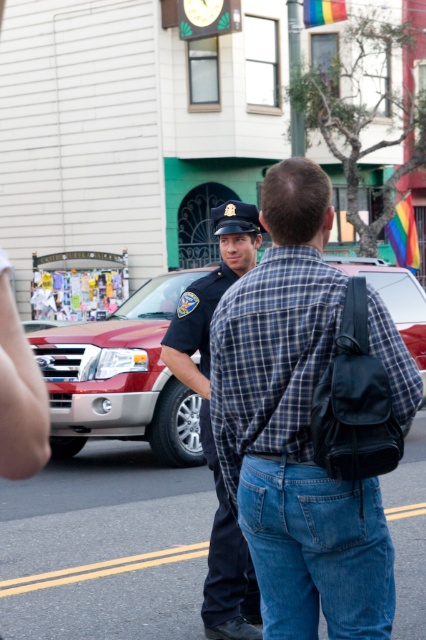
Does blue plaid shirt at center appear over dark blue uniform at center?

Indeed, blue plaid shirt at center is positioned over dark blue uniform at center.

Which of these two, blue plaid shirt at center or dark blue uniform at center, stands shorter?

blue plaid shirt at center is shorter.

Measure the distance between point [229,404] and camera.

10.60 feet

Find the location of `blue plaid shirt at center`. blue plaid shirt at center is located at coordinates (294, 428).

Who is more distant from viewer, (313,164) or (57,408)?

Positioned behind is point (57,408).

Which is below, blue plaid shirt at center or metallic red suv at center-left?

Positioned lower is metallic red suv at center-left.

The image size is (426, 640). In order to click on blue plaid shirt at center in this screenshot , I will do `click(294, 428)`.

Can you confirm if metallic red suv at center-left is taller than dark blue uniform at center?

No.

Is point (94, 372) farther from viewer compared to point (222, 280)?

Yes.

Is point (195, 440) farther from viewer compared to point (224, 636)?

Yes, it is.

The width and height of the screenshot is (426, 640). Identify the location of metallic red suv at center-left. (121, 378).